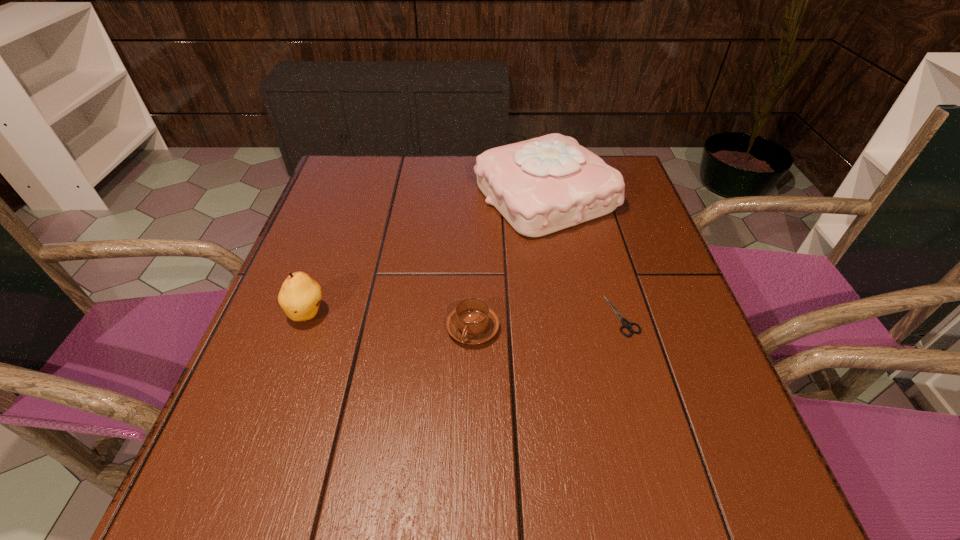
This screenshot has height=540, width=960. I want to click on object situated at the far edge, so click(540, 186).

Identify the location of object present at the left edge. (300, 296).

Where is `cake positioned at the right edge`? The image size is (960, 540). cake positioned at the right edge is located at coordinates (540, 186).

The image size is (960, 540). What are the coordinates of `shears that is positioned at the right edge` in the screenshot? It's located at (626, 324).

Find the location of a particular element. Image resolution: width=960 pixels, height=540 pixels. object situated at the far right corner is located at coordinates (540, 186).

Locate an element on the screen. The height and width of the screenshot is (540, 960). vacant region at the far edge of the desktop is located at coordinates pyautogui.click(x=431, y=187).

Identify the location of vacant space at the near edge of the desktop. (403, 516).

Locate an element on the screen. free space at the left edge of the desktop is located at coordinates (290, 264).

The width and height of the screenshot is (960, 540). I want to click on vacant space at the right edge, so click(711, 420).

The height and width of the screenshot is (540, 960). In the image, there is a desktop. Find the location of `vacant region at the far right corner`. vacant region at the far right corner is located at coordinates (628, 173).